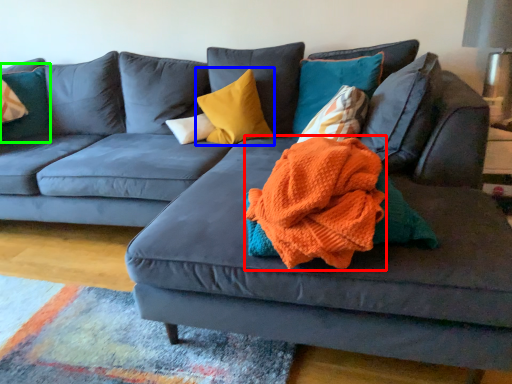
Question: Based on their relative distances, which object is nearer to blanket (highlighted by a red box)? Choose from pillow (highlighted by a blue box) and pillow (highlighted by a green box).

Choices:
 (A) pillow
 (B) pillow

Answer: (A)